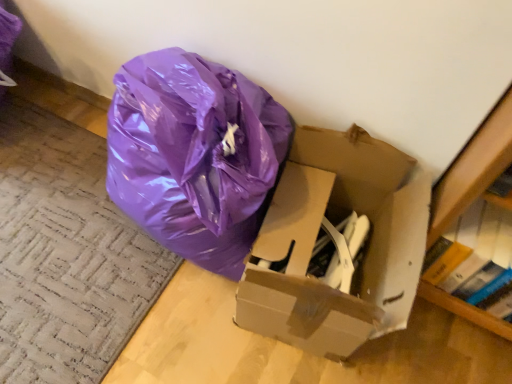
Question: From a real-world perspective, relative to cardboard box at center, is hardcover book at right vertically above or below?

Choices:
 (A) below
 (B) above

Answer: (B)

Question: Is point (474, 223) closer or farther from the camera than point (303, 301)?

Choices:
 (A) farther
 (B) closer

Answer: (A)

Question: Is hardcover book at right wider or thinner than cardboard box at center?

Choices:
 (A) thin
 (B) wide

Answer: (A)

Question: From their relative heights in the image, would you say cardboard box at center is taller or shorter than hardcover book at right?

Choices:
 (A) short
 (B) tall

Answer: (B)

Question: Is cardboard box at center inside or outside of hardcover book at right?

Choices:
 (A) inside
 (B) outside

Answer: (B)

Question: From a real-world perspective, is cardboard box at center positioned above or below hardcover book at right?

Choices:
 (A) above
 (B) below

Answer: (B)

Question: Would you say cardboard box at center is to the left or to the right of hardcover book at right in the picture?

Choices:
 (A) right
 (B) left

Answer: (B)